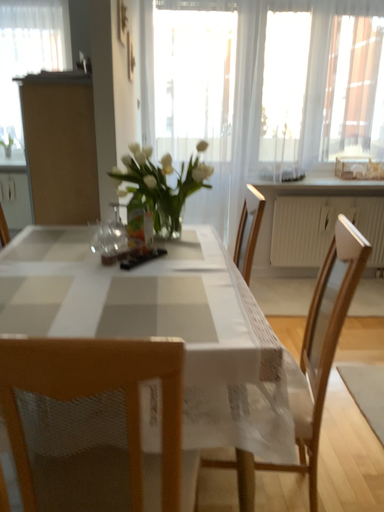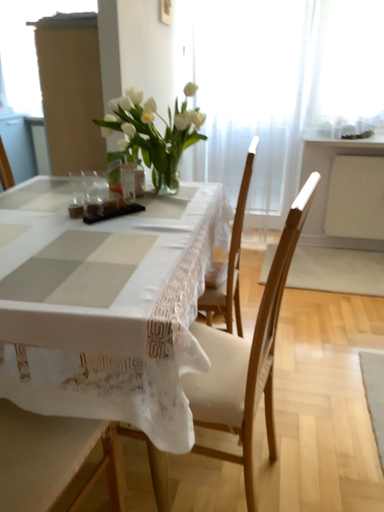
Question: How did the camera likely rotate when shooting the video?

Choices:
 (A) rotated left
 (B) rotated right

Answer: (A)